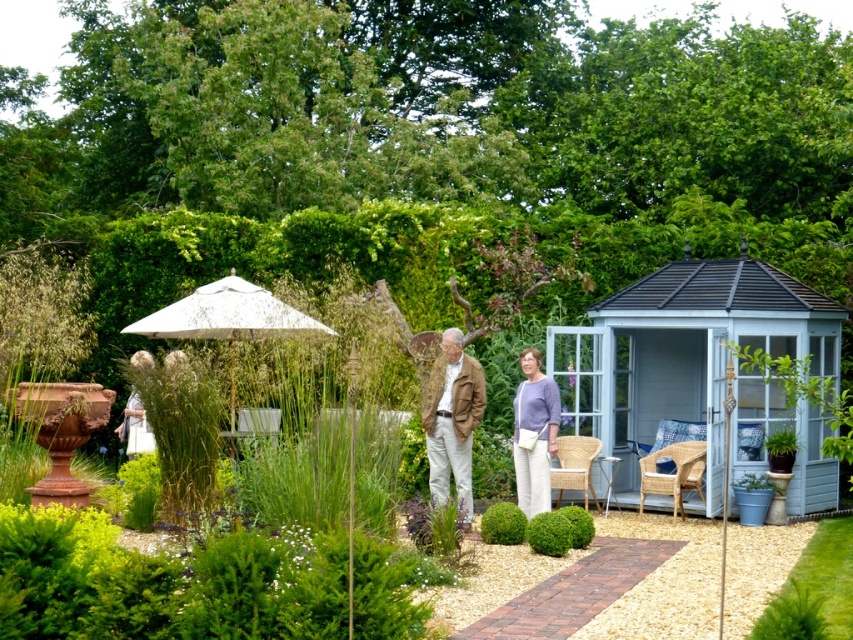
You are planning to place a small statue between the green leafy plant at lower right and the green fuzzy ball at center in the garden. Based on their positions, where should you position the statue to ensure it is between both objects?

The green leafy plant at lower right is located above the green fuzzy ball at center, so to place the statue between them, position it below the green leafy plant at lower right and above the green fuzzy ball at center.

You are standing in the garden and want to place a small decorative statue exactly at the point marked by the coordinates point [791,616]. Based on the garden layout, where would this statue be placed?

The point [791,616] corresponds to the green leafy plant at lower right, so placing the statue there would position it among the green leafy plant at lower right.

You are planning to place a new potted plant in the garden. You want it to be between the light blue wooden gazebo at right and the brown leather jacket at center. Is this possible based on their current positions?

The light blue wooden gazebo at right is to the right of the brown leather jacket at center, so there is space between them. You can place the potted plant between the light blue wooden gazebo at right and the brown leather jacket at center.